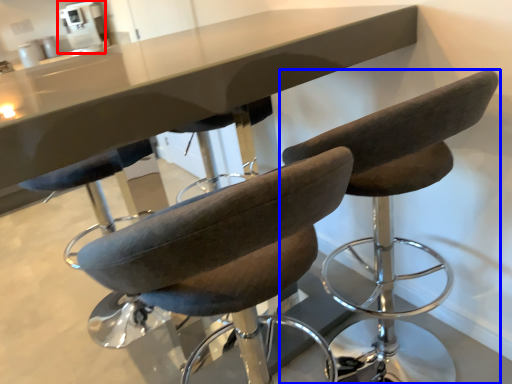
Question: Among these objects, which one is nearest to the camera, coffee machine (highlighted by a red box) or chair (highlighted by a blue box)?

Choices:
 (A) coffee machine
 (B) chair

Answer: (B)